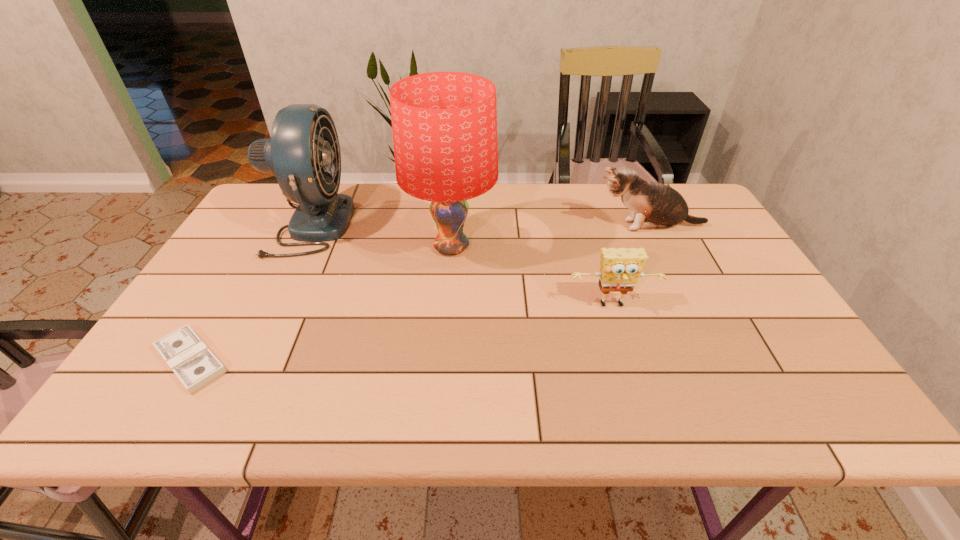
Identify the location of dollar that is at the left edge. The height and width of the screenshot is (540, 960). (190, 359).

The image size is (960, 540). I want to click on object situated at the right edge, so click(x=653, y=205).

Where is `object situated at the far left corner`? object situated at the far left corner is located at coordinates (303, 152).

Find the location of a particular element. The height and width of the screenshot is (540, 960). object at the near left corner is located at coordinates (190, 359).

In order to click on object located at the far right corner in this screenshot , I will do `click(653, 205)`.

Identify the location of vacant point at the far edge. (536, 219).

The height and width of the screenshot is (540, 960). In order to click on vacant space at the near edge in this screenshot , I will do `click(615, 403)`.

Image resolution: width=960 pixels, height=540 pixels. In order to click on blank space at the left edge of the desktop in this screenshot , I will do `click(241, 262)`.

This screenshot has height=540, width=960. I want to click on vacant space at the right edge of the desktop, so click(x=808, y=368).

In the image, there is a desktop. Where is `free space at the far left corner`? The image size is (960, 540). free space at the far left corner is located at coordinates (275, 218).